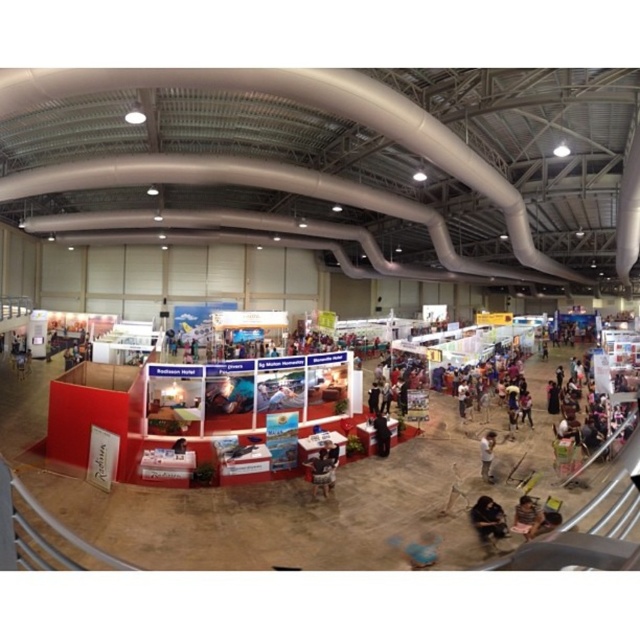
Question: Can you confirm if dark fabric bag at lower right is positioned to the left of brown leather jacket at center?

Choices:
 (A) no
 (B) yes

Answer: (A)

Question: Does brown leather jacket at center have a smaller size compared to dark brown leather jacket at lower right?

Choices:
 (A) yes
 (B) no

Answer: (B)

Question: Can you confirm if dark fabric bag at lower right is wider than dark brown leather jacket at lower right?

Choices:
 (A) no
 (B) yes

Answer: (B)

Question: Which of the following is the closest to the observer?

Choices:
 (A) (492, 452)
 (B) (499, 524)

Answer: (B)

Question: Which object appears farthest from the camera in this image?

Choices:
 (A) brown leather jacket at center
 (B) dark brown leather jacket at lower right
 (C) dark fabric bag at lower right

Answer: (B)

Question: Which of the following is the farthest from the observer?

Choices:
 (A) dark brown leather jacket at lower right
 (B) brown leather jacket at center

Answer: (A)